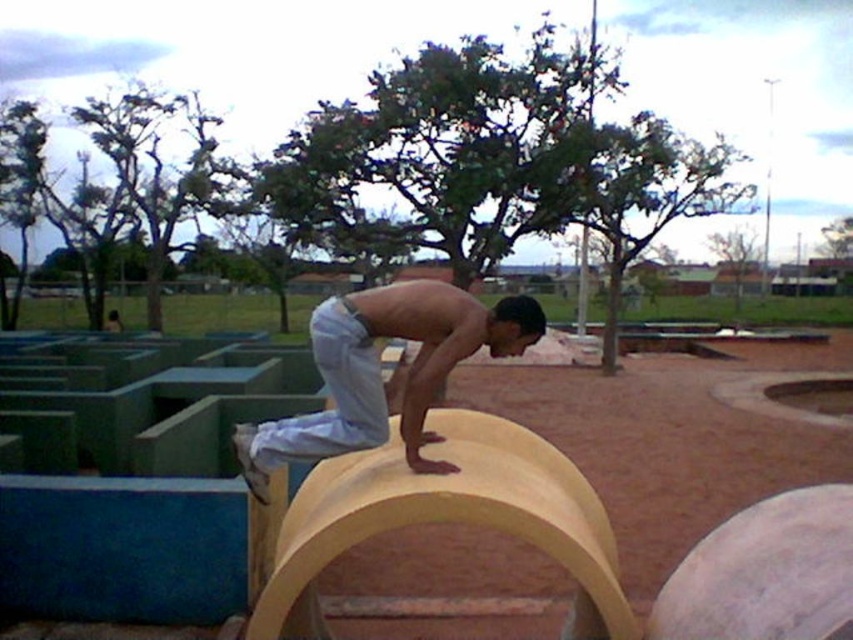
You are a photographer trying to capture the man in light blue denim pants at center while avoiding the yellow matte obstacle at center. Based on their positions, is the obstacle blocking your view of the pants?

The yellow matte obstacle at center is located below light blue denim pants at center, so it is not blocking the view of the pants since it is positioned lower down.

You are a photographer standing at the skate park and want to capture a photo of the yellow matte obstacle at center and the light blue denim pants at center. Which object should you focus on first to ensure both are in sharp focus?

The yellow matte obstacle at center is further to the viewer than light blue denim pants at center, so you should focus on the yellow matte obstacle at center first to ensure both are in sharp focus.